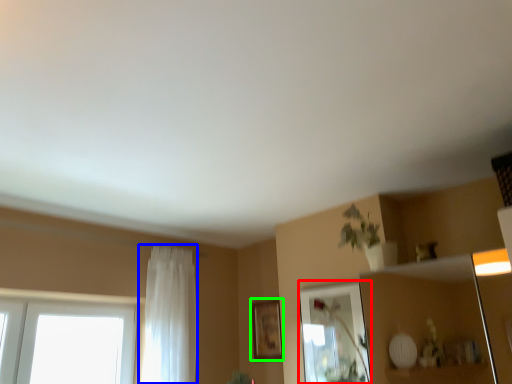
Question: Which object is the closest to the mirror (highlighted by a red box)? Choose among these: curtain (highlighted by a blue box) or picture frame (highlighted by a green box).

Choices:
 (A) curtain
 (B) picture frame

Answer: (B)